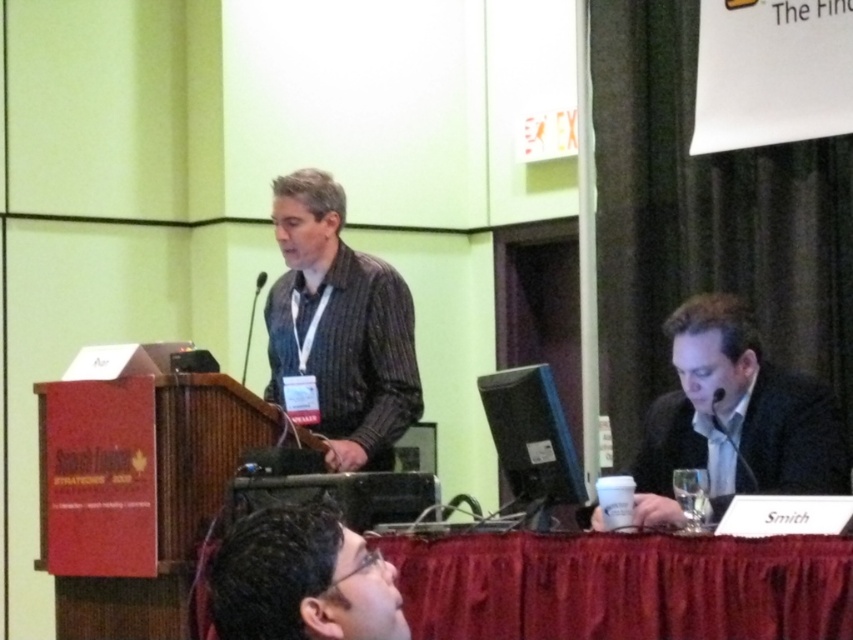
You are attending a conference and need to locate the speaker who is wearing a striped fabric shirt at left and someone with matte black glasses at lower center. Which one is positioned more to the left side of the image?

The striped fabric shirt at left is positioned more to the left side of the image than the matte black glasses at lower center.